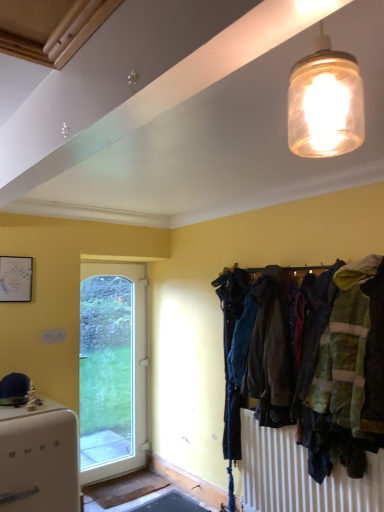
What do you see at coordinates (325, 102) in the screenshot?
I see `translucent glass jar at upper center` at bounding box center [325, 102].

The height and width of the screenshot is (512, 384). Describe the element at coordinates (112, 369) in the screenshot. I see `white glossy door at left` at that location.

Find the location of a particular element. This screenshot has width=384, height=512. translucent glass jar at upper center is located at coordinates (325, 102).

Is there a large distance between translucent glass jar at upper center and white matte refrigerator at lower left?

translucent glass jar at upper center is positioned a significant distance from white matte refrigerator at lower left.

Does translucent glass jar at upper center have a greater height compared to white matte refrigerator at lower left?

No, translucent glass jar at upper center is not taller than white matte refrigerator at lower left.

Considering the relative sizes of translucent glass jar at upper center and white matte refrigerator at lower left in the image provided, is translucent glass jar at upper center smaller than white matte refrigerator at lower left?

Yes.

Which is more to the left, translucent glass jar at upper center or white matte refrigerator at lower left?

white matte refrigerator at lower left is more to the left.

What's the angular difference between dark blue fabric coat at center right and white matte refrigerator at lower left's facing directions?

There is a 89-degree angle between the facing directions of dark blue fabric coat at center right and white matte refrigerator at lower left.

Between dark blue fabric coat at center right and white matte refrigerator at lower left, which one has smaller size?

dark blue fabric coat at center right.

Which is behind, dark blue fabric coat at center right or white matte refrigerator at lower left?

dark blue fabric coat at center right is further from the camera.

Is there a large distance between dark blue fabric coat at center right and white matte refrigerator at lower left?

dark blue fabric coat at center right is positioned a significant distance from white matte refrigerator at lower left.

What's the angular difference between white matte refrigerator at lower left and translucent glass jar at upper center's facing directions?

The angular difference between white matte refrigerator at lower left and translucent glass jar at upper center is 90.5 degrees.

Would you say white matte refrigerator at lower left is inside or outside translucent glass jar at upper center?

white matte refrigerator at lower left is not inside translucent glass jar at upper center, it's outside.

Does white matte refrigerator at lower left turn towards translucent glass jar at upper center?

No, white matte refrigerator at lower left does not turn towards translucent glass jar at upper center.

Considering the relative sizes of white matte refrigerator at lower left and translucent glass jar at upper center in the image provided, is white matte refrigerator at lower left thinner than translucent glass jar at upper center?

Incorrect, the width of white matte refrigerator at lower left is not less than that of translucent glass jar at upper center.

From the picture: Considering the sizes of white glossy door at left and dark blue fabric coat at center right in the image, is white glossy door at left wider or thinner than dark blue fabric coat at center right?

Considering their sizes, white glossy door at left looks slimmer than dark blue fabric coat at center right.

From a real-world perspective, is white glossy door at left positioned under dark blue fabric coat at center right based on gravity?

Correct, in the physical world, white glossy door at left is lower than dark blue fabric coat at center right.

From the image's perspective, which object appears higher, white glossy door at left or dark blue fabric coat at center right?

dark blue fabric coat at center right is shown above in the image.

From their relative heights in the image, would you say white glossy door at left is taller or shorter than dark blue fabric coat at center right?

Clearly, white glossy door at left is taller compared to dark blue fabric coat at center right.

Is white glossy door at left facing away from translucent glass jar at upper center?

No.

Does point (138, 330) appear closer or farther from the camera than point (350, 131)?

Point (138, 330) is positioned farther from the camera compared to point (350, 131).

Would you say white glossy door at left is outside translucent glass jar at upper center?

Yes, white glossy door at left is not within translucent glass jar at upper center.

Where is `door that is behind the translucent glass jar at upper center`? Image resolution: width=384 pixels, height=512 pixels. door that is behind the translucent glass jar at upper center is located at coordinates (112, 369).

From the image's perspective, which is below, dark blue fabric coat at center right or translucent glass jar at upper center?

dark blue fabric coat at center right, from the image's perspective.

Considering the sizes of dark blue fabric coat at center right and translucent glass jar at upper center in the image, is dark blue fabric coat at center right taller or shorter than translucent glass jar at upper center?

dark blue fabric coat at center right is taller than translucent glass jar at upper center.

Does dark blue fabric coat at center right turn towards translucent glass jar at upper center?

No, dark blue fabric coat at center right is not facing towards translucent glass jar at upper center.

In terms of size, does dark blue fabric coat at center right appear bigger or smaller than translucent glass jar at upper center?

Clearly, dark blue fabric coat at center right is larger in size than translucent glass jar at upper center.

Considering the positions of objects white matte refrigerator at lower left and dark blue fabric coat at center right in the image provided, who is more to the left, white matte refrigerator at lower left or dark blue fabric coat at center right?

white matte refrigerator at lower left is more to the left.

Based on the photo, in terms of height, does white matte refrigerator at lower left look taller or shorter compared to dark blue fabric coat at center right?

Considering their sizes, white matte refrigerator at lower left has less height than dark blue fabric coat at center right.

What's the angular difference between white matte refrigerator at lower left and dark blue fabric coat at center right's facing directions?

There is a 89-degree angle between the facing directions of white matte refrigerator at lower left and dark blue fabric coat at center right.

From a real-world perspective, which is physically below, white matte refrigerator at lower left or dark blue fabric coat at center right?

white matte refrigerator at lower left.

The image size is (384, 512). What are the coordinates of `lamp in front of the white matte refrigerator at lower left` in the screenshot? It's located at (325, 102).

Locate an element on the screen. appliance lying below the dark blue fabric coat at center right (from the image's perspective) is located at coordinates (39, 458).

Looking at the image, which one is located further to white glossy door at left, dark blue fabric coat at center right or translucent glass jar at upper center?

translucent glass jar at upper center lies further to white glossy door at left than the other object.

Looking at this image, considering their positions, is translucent glass jar at upper center positioned further to white glossy door at left than dark blue fabric coat at center right?

translucent glass jar at upper center is further to white glossy door at left.

From the image, which object appears to be nearer to translucent glass jar at upper center, white glossy door at left or white matte refrigerator at lower left?

Among the two, white matte refrigerator at lower left is located nearer to translucent glass jar at upper center.

Estimate the real-world distances between objects in this image. Which object is further from dark blue fabric coat at center right, translucent glass jar at upper center or white glossy door at left?

white glossy door at left is positioned further to the anchor dark blue fabric coat at center right.

Considering their positions, is white matte refrigerator at lower left positioned further to dark blue fabric coat at center right than translucent glass jar at upper center?

Based on the image, translucent glass jar at upper center appears to be further to dark blue fabric coat at center right.

Which object lies nearer to the anchor point translucent glass jar at upper center, dark blue fabric coat at center right or white matte refrigerator at lower left?

dark blue fabric coat at center right is closer to translucent glass jar at upper center.

From the image, which object appears to be farther from dark blue fabric coat at center right, white glossy door at left or translucent glass jar at upper center?

white glossy door at left is positioned further to the anchor dark blue fabric coat at center right.

Looking at the image, which one is located further to white glossy door at left, white matte refrigerator at lower left or translucent glass jar at upper center?

The object further to white glossy door at left is translucent glass jar at upper center.

I want to click on clothing positioned between translucent glass jar at upper center and white glossy door at left from near to far, so click(270, 351).

I want to click on appliance positioned between translucent glass jar at upper center and white glossy door at left from near to far, so click(39, 458).

You are a GUI agent. You are given a task and a screenshot of the screen. Output one action in this format:
    pyautogui.click(x=<x>, y=<y>)
    Task: Click on the door situated between white matte refrigerator at lower left and dark blue fabric coat at center right from left to right
    The width and height of the screenshot is (384, 512).
    Given the screenshot: What is the action you would take?
    (x=112, y=369)

The height and width of the screenshot is (512, 384). What are the coordinates of `appliance between translucent glass jar at upper center and dark blue fabric coat at center right from front to back` in the screenshot? It's located at (39, 458).